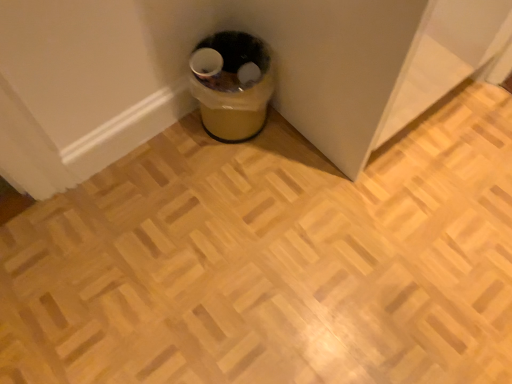
Locate an element on the screen. The image size is (512, 384). vacant region in front of yellow plastic trash can at lower left is located at coordinates (237, 164).